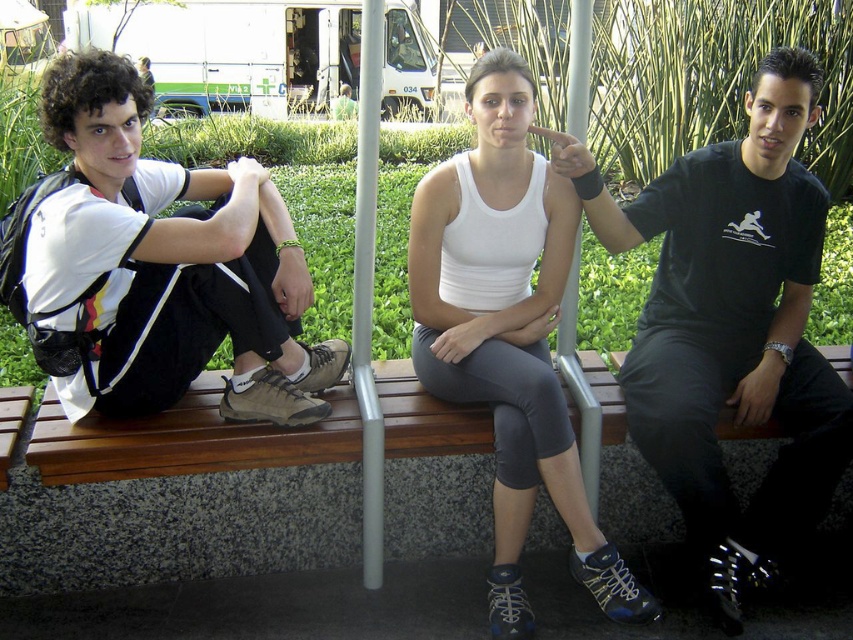
Question: Which object is positioned farthest from the white matte tank top at center?

Choices:
 (A) brown wooden bench at center
 (B) white matte t-shirt at left
 (C) black matte shirt at center

Answer: (B)

Question: Is white matte t-shirt at left to the left of white matte tank top at center from the viewer's perspective?

Choices:
 (A) yes
 (B) no

Answer: (A)

Question: Can you confirm if black matte shirt at center is wider than brown wooden bench at center?

Choices:
 (A) yes
 (B) no

Answer: (B)

Question: Among these points, which one is nearest to the camera?

Choices:
 (A) (720, 388)
 (B) (554, 397)

Answer: (B)

Question: Can you confirm if black matte shirt at center is bigger than brown wooden bench at center?

Choices:
 (A) no
 (B) yes

Answer: (B)

Question: Estimate the real-world distances between objects in this image. Which object is farther from the white matte t-shirt at left?

Choices:
 (A) white matte tank top at center
 (B) brown wooden bench at center
 (C) black matte shirt at center

Answer: (C)